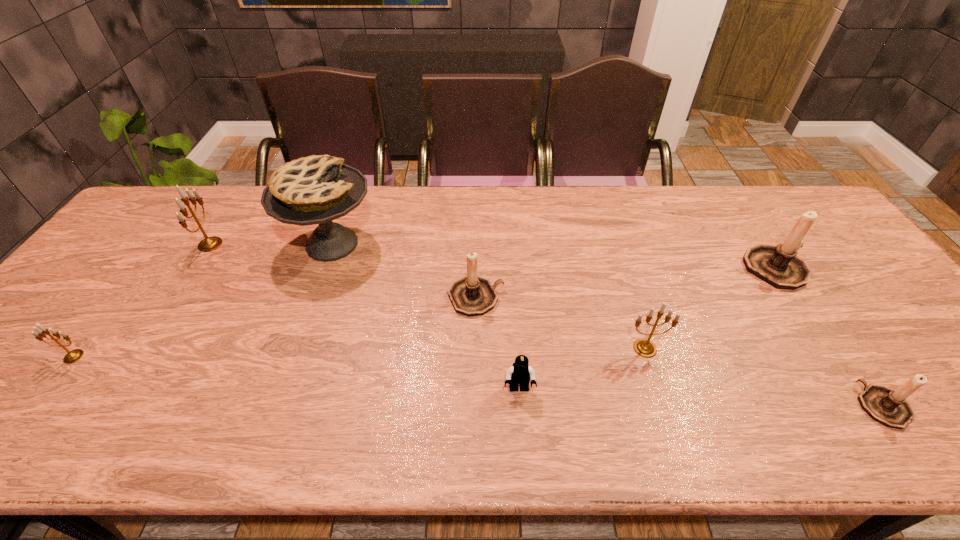
Where is `the nearest candelabrum`? the nearest candelabrum is located at coordinates click(x=888, y=407).

The height and width of the screenshot is (540, 960). Identify the location of the smallest gold candelabrum. (72, 356).

Identify the location of the leftmost gold candelabrum. (72, 356).

Find the location of a particular element. Lego is located at coordinates (520, 373).

Where is `free space located 0.340m on the cut side of the tallest object`? free space located 0.340m on the cut side of the tallest object is located at coordinates (493, 244).

Image resolution: width=960 pixels, height=540 pixels. I want to click on free space located on the back of the biggest brown candle holder, so click(743, 218).

Identify the location of free space located 0.150m on the left of the farthest gold candelabrum. The width and height of the screenshot is (960, 540). (148, 244).

Identify the location of vacant region located on the right of the second biggest gold candelabrum. (694, 348).

You are a GUI agent. You are given a task and a screenshot of the screen. Output one action in this format:
    pyautogui.click(x=<x>, y=<y>)
    Task: Click on the vacant space situated 0.250m on the right of the third candelabrum from left to right
    
    Given the screenshot: What is the action you would take?
    pyautogui.click(x=599, y=297)

This screenshot has width=960, height=540. Identify the location of free location located 0.270m on the back of the nearest brown candle holder. (805, 294).